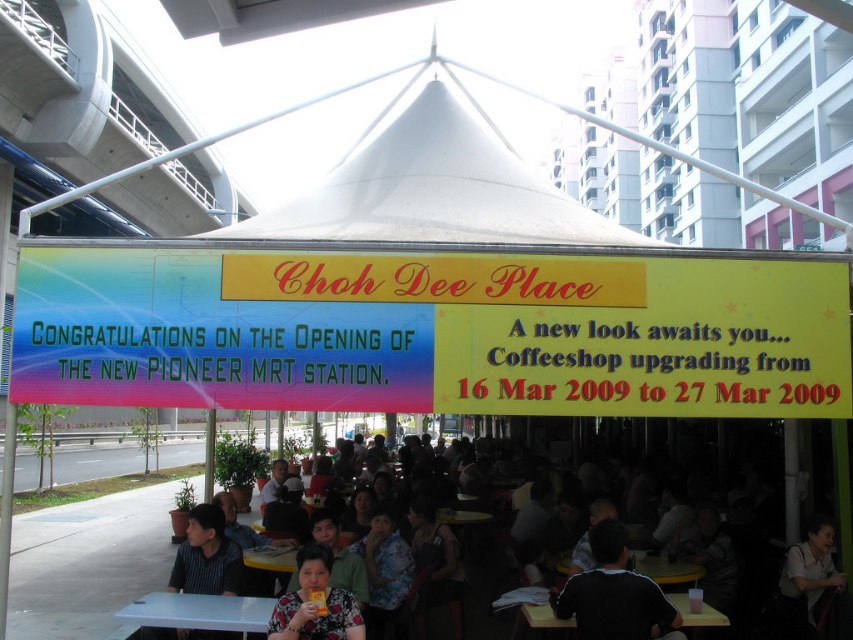
You are a delivery person carrying a box that is 2 meters long. You need to walk from the multicolored plastic signboard at center to the floral fabric shirt at lower center. Can you pass through without tilting the box?

The distance between the multicolored plastic signboard at center and the floral fabric shirt at lower center is 2.10 meters. Since the box is 2 meters long, you can pass through without tilting the box as there is enough space.

You are at the event and need to find the signboard to take a photo. Which object is larger between the multicolored plastic signboard at center and the floral fabric shirt at lower center?

The multicolored plastic signboard at center is bigger than the floral fabric shirt at lower center, so the signboard is the larger object.